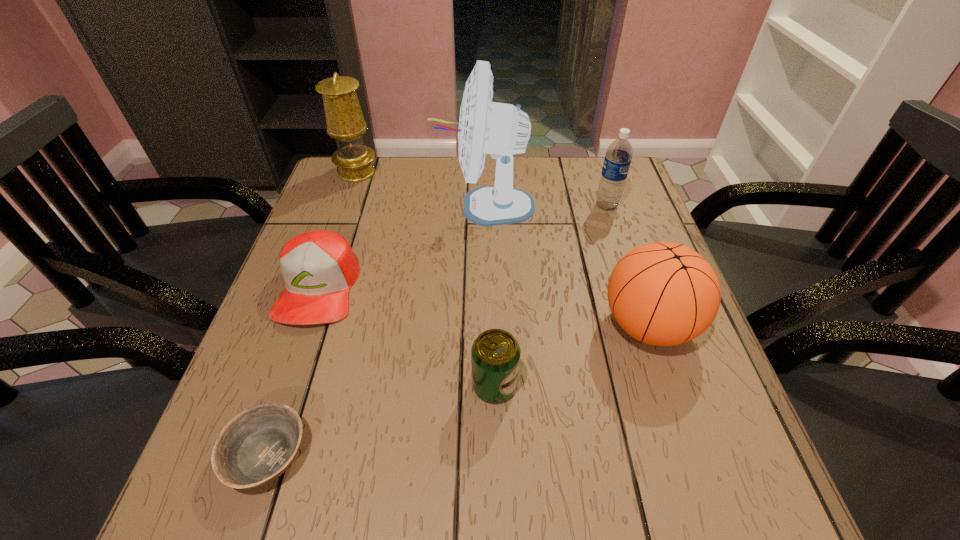
You are a GUI agent. You are given a task and a screenshot of the screen. Output one action in this format:
    pyautogui.click(x=<x>, y=<y>)
    Task: Click on the free space located on the grille of the fan
    The width and height of the screenshot is (960, 540).
    Given the screenshot: What is the action you would take?
    pyautogui.click(x=412, y=206)

Identify the location of vacant region located on the right of the sixth shortest object. The width and height of the screenshot is (960, 540). (471, 172).

Identify the location of free space located 0.120m on the back of the water bottle. (596, 174).

This screenshot has height=540, width=960. Find the location of `free location located 0.230m on the left of the basketball`. free location located 0.230m on the left of the basketball is located at coordinates (491, 325).

Where is `vacant region located on the right of the beer can`? This screenshot has width=960, height=540. vacant region located on the right of the beer can is located at coordinates (549, 385).

Find the location of a particular element. free space located on the front-facing side of the sixth tallest object is located at coordinates (245, 501).

What are the coordinates of `vacant space located 0.340m on the back of the nearest object` in the screenshot? It's located at (326, 278).

Identify the location of fan positioned at the far edge. [501, 130].

Identify the location of oil lamp that is at the far edge. Image resolution: width=960 pixels, height=540 pixels. (344, 118).

Locate an element on the screen. This screenshot has height=540, width=960. water bottle present at the far edge is located at coordinates (618, 156).